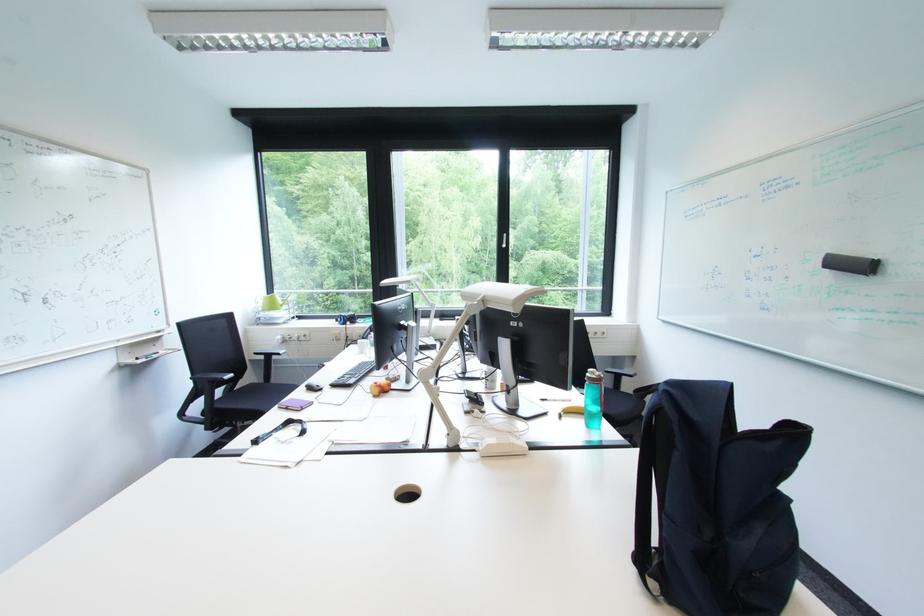
Find the location of `black chair armrest`. black chair armrest is located at coordinates (268, 351).